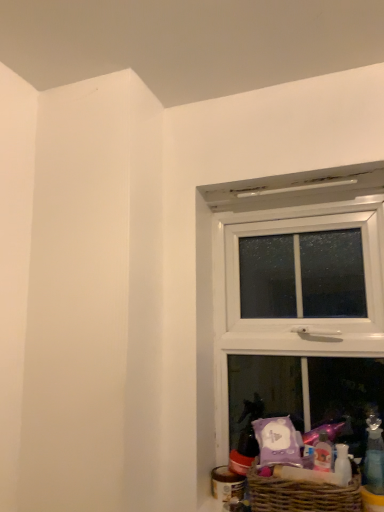
Question: Is the surface of transparent plastic bottle at lower right in direct contact with brown wicker basket at lower right?

Choices:
 (A) yes
 (B) no

Answer: (B)

Question: Can you confirm if transparent plastic bottle at lower right is shorter than brown wicker basket at lower right?

Choices:
 (A) yes
 (B) no

Answer: (B)

Question: Considering the relative sizes of transparent plastic bottle at lower right and brown wicker basket at lower right in the image provided, is transparent plastic bottle at lower right smaller than brown wicker basket at lower right?

Choices:
 (A) no
 (B) yes

Answer: (B)

Question: Is transparent plastic bottle at lower right closer to the viewer compared to brown wicker basket at lower right?

Choices:
 (A) yes
 (B) no

Answer: (B)

Question: From a real-world perspective, is transparent plastic bottle at lower right on brown wicker basket at lower right?

Choices:
 (A) no
 (B) yes

Answer: (B)

Question: Relative to brown wicker basket at lower right, is transparent plastic bottle at lower right in front or behind?

Choices:
 (A) front
 (B) behind

Answer: (B)

Question: From the image's perspective, is transparent plastic bottle at lower right located above or below brown wicker basket at lower right?

Choices:
 (A) below
 (B) above

Answer: (B)

Question: From a real-world perspective, is transparent plastic bottle at lower right physically located above or below brown wicker basket at lower right?

Choices:
 (A) above
 (B) below

Answer: (A)

Question: Looking at the image, does transparent plastic bottle at lower right seem bigger or smaller compared to brown wicker basket at lower right?

Choices:
 (A) small
 (B) big

Answer: (A)

Question: From a real-world perspective, is white plastic window at upper right positioned above or below transparent plastic bottle at lower right?

Choices:
 (A) below
 (B) above

Answer: (B)

Question: Is white plastic window at upper right to the left or to the right of transparent plastic bottle at lower right in the image?

Choices:
 (A) right
 (B) left

Answer: (B)

Question: Considering their positions, is white plastic window at upper right located in front of or behind transparent plastic bottle at lower right?

Choices:
 (A) front
 (B) behind

Answer: (B)

Question: Is white plastic window at upper right spatially inside transparent plastic bottle at lower right, or outside of it?

Choices:
 (A) outside
 (B) inside

Answer: (A)

Question: Considering the relative positions of brown wicker basket at lower right and transparent plastic bottle at lower right in the image provided, is brown wicker basket at lower right to the left or to the right of transparent plastic bottle at lower right?

Choices:
 (A) left
 (B) right

Answer: (A)

Question: Is brown wicker basket at lower right inside or outside of transparent plastic bottle at lower right?

Choices:
 (A) inside
 (B) outside

Answer: (B)